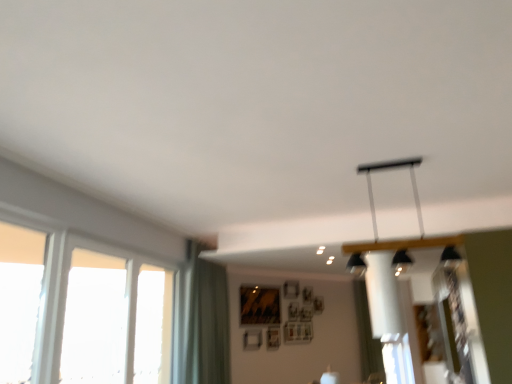
Where is `green fabric curtain at lower left, the second curtain from the back`? This screenshot has width=512, height=384. green fabric curtain at lower left, the second curtain from the back is located at coordinates (200, 321).

What do you see at coordinates (80, 309) in the screenshot?
I see `clear glass window at left, the 3th window viewed from the left` at bounding box center [80, 309].

You are a GUI agent. You are given a task and a screenshot of the screen. Output one action in this format:
    pyautogui.click(x=<x>, y=<y>)
    Task: Click on the white plastic window at left, which is the 1th window from left to right
    Image resolution: width=512 pixels, height=384 pixels.
    Given the screenshot: What is the action you would take?
    pyautogui.click(x=19, y=299)

Considering the sizes of objects transparent glass window at left, which is counted as the second window, starting from the right, and green fabric curtain at lower left, the first curtain viewed from the front, in the image provided, who is thinner, transparent glass window at left, which is counted as the second window, starting from the right, or green fabric curtain at lower left, the first curtain viewed from the front,?

Thinner between the two is transparent glass window at left, which is counted as the second window, starting from the right.

Is transparent glass window at left, which is counted as the 2th window, starting from the left, smaller than green fabric curtain at lower left, the 1th curtain in the left-to-right sequence?

Indeed, transparent glass window at left, which is counted as the 2th window, starting from the left, has a smaller size compared to green fabric curtain at lower left, the 1th curtain in the left-to-right sequence.

Based on the photo, from a real-world perspective, which is physically below, transparent glass window at left, which is counted as the second window, starting from the right, or green fabric curtain at lower left, the second curtain from the back?

transparent glass window at left, which is counted as the second window, starting from the right, from a real-world perspective.

Consider the image. Is transparent glass window at left, which is counted as the 2th window, starting from the left, positioned beyond the bounds of green fabric curtain at lower left, arranged as the 2th curtain when viewed from the right?

Yes.

From the image's perspective, is white plastic window at left, the third window from the right, located beneath clear glass window at left, placed as the first window when sorted from right to left?

No.

Is white plastic window at left, which is the 1th window from left to right, turned away from clear glass window at left, placed as the first window when sorted from right to left?

white plastic window at left, which is the 1th window from left to right, does not have its back to clear glass window at left, placed as the first window when sorted from right to left.

Based on the photo, is white plastic window at left, the third window from the right, to the left or to the right of clear glass window at left, placed as the first window when sorted from right to left, in the image?

From the image, it's evident that white plastic window at left, the third window from the right, is to the left of clear glass window at left, placed as the first window when sorted from right to left.

Could clear glass window at left, placed as the first window when sorted from right to left, be considered to be inside white plastic window at left, which is the 1th window from left to right?

That's incorrect, clear glass window at left, placed as the first window when sorted from right to left, is not inside white plastic window at left, which is the 1th window from left to right.

From a real-world perspective, does green fabric curtain at lower left, arranged as the 2th curtain when viewed from the right, stand above clear glass window at left, the 3th window viewed from the left?

Yes, from a real-world perspective, green fabric curtain at lower left, arranged as the 2th curtain when viewed from the right, is over clear glass window at left, the 3th window viewed from the left

Where is `curtain above the clear glass window at left, placed as the first window when sorted from right to left (from a real-world perspective)`? The image size is (512, 384). curtain above the clear glass window at left, placed as the first window when sorted from right to left (from a real-world perspective) is located at coordinates (200, 321).

Does green fabric curtain at lower left, the first curtain viewed from the front, have a greater height compared to clear glass window at left, the 3th window viewed from the left?

Yes.

Between green fabric curtain at lower left, arranged as the 2th curtain when viewed from the right, and clear glass window at left, the 3th window viewed from the left, which one has smaller size?

Smaller between the two is clear glass window at left, the 3th window viewed from the left.

Where is `window that appears on the left of transparent glass window at left, which is counted as the 2th window, starting from the left`? window that appears on the left of transparent glass window at left, which is counted as the 2th window, starting from the left is located at coordinates (19, 299).

How distant is transparent glass window at left, which is counted as the 2th window, starting from the left, from white plastic window at left, the third window from the right?

transparent glass window at left, which is counted as the 2th window, starting from the left, is 17.89 inches away from white plastic window at left, the third window from the right.

What's the angular difference between transparent glass window at left, which is counted as the 2th window, starting from the left, and white plastic window at left, the third window from the right,'s facing directions?

There is a 0.3-degree angle between the facing directions of transparent glass window at left, which is counted as the 2th window, starting from the left, and white plastic window at left, the third window from the right.

Looking at this image, considering the relative sizes of transparent glass window at left, which is counted as the second window, starting from the right, and white plastic window at left, which is the 1th window from left to right, in the image provided, is transparent glass window at left, which is counted as the second window, starting from the right, wider than white plastic window at left, which is the 1th window from left to right,?

Incorrect, the width of transparent glass window at left, which is counted as the second window, starting from the right, does not surpass that of white plastic window at left, which is the 1th window from left to right.

Which object is further away from the camera taking this photo, transparent glass window at left, which is counted as the 2th window, starting from the left, or clear glass window at left, placed as the first window when sorted from right to left?

transparent glass window at left, which is counted as the 2th window, starting from the left, is further from the camera.

Would you say transparent glass window at left, which is counted as the 2th window, starting from the left, is inside or outside clear glass window at left, the 3th window viewed from the left?

The correct answer is: inside.

Which point is more distant from viewer, [92,265] or [11,314]?

The point [92,265] is more distant.

Consider the image. Who is taller, transparent glass window at left, which is counted as the 2th window, starting from the left, or clear glass window at left, the 3th window viewed from the left?

Standing taller between the two is clear glass window at left, the 3th window viewed from the left.

Consider the image. Considering the relative sizes of white fabric curtain at center, the 1th curtain from the right, and clear glass window at left, the 3th window viewed from the left, in the image provided, is white fabric curtain at center, the 1th curtain from the right, shorter than clear glass window at left, the 3th window viewed from the left,?

Incorrect, the height of white fabric curtain at center, the 1th curtain from the right, does not fall short of that of clear glass window at left, the 3th window viewed from the left.

Between white fabric curtain at center, the 1th curtain from the right, and clear glass window at left, the 3th window viewed from the left, which one has larger width?

Wider between the two is white fabric curtain at center, the 1th curtain from the right.

From the image's perspective, is white fabric curtain at center, the 2th curtain from the front, on clear glass window at left, the 3th window viewed from the left?

No.

Is white fabric curtain at center, the 1th curtain from the back, positioned in front of clear glass window at left, placed as the first window when sorted from right to left?

No, it is not.

Who is bigger, clear glass window at left, the 3th window viewed from the left, or transparent glass window at left, which is counted as the 2th window, starting from the left?

clear glass window at left, the 3th window viewed from the left.

From the picture: Does clear glass window at left, placed as the first window when sorted from right to left, turn towards transparent glass window at left, which is counted as the 2th window, starting from the left?

Yes, clear glass window at left, placed as the first window when sorted from right to left, is aimed at transparent glass window at left, which is counted as the 2th window, starting from the left.

From the image's perspective, who appears lower, clear glass window at left, the 3th window viewed from the left, or transparent glass window at left, which is counted as the second window, starting from the right?

From the image's view, clear glass window at left, the 3th window viewed from the left, is below.

Who is more distant, clear glass window at left, placed as the first window when sorted from right to left, or transparent glass window at left, which is counted as the second window, starting from the right?

transparent glass window at left, which is counted as the second window, starting from the right, is further away from the camera.

From the image's perspective, count 2nd windows upward from the green fabric curtain at lower left, the second curtain from the back, and point to it. Please provide its 2D coordinates.

[(95, 319)]

Locate an element on the screen. This screenshot has width=512, height=384. the 1st window behind the white plastic window at left, the third window from the right, starting your count from the anchor is located at coordinates (80, 309).

Looking at the image, which one is located further to clear glass window at left, the 3th window viewed from the left, white fabric curtain at center, positioned as the second curtain in left-to-right order, or white plastic window at left, which is the 1th window from left to right?

Based on the image, white fabric curtain at center, positioned as the second curtain in left-to-right order, appears to be further to clear glass window at left, the 3th window viewed from the left.

When comparing their distances from white plastic window at left, the third window from the right, does green fabric curtain at lower left, arranged as the 2th curtain when viewed from the right, or white fabric curtain at center, the 2th curtain from the front, seem further?

Based on the image, white fabric curtain at center, the 2th curtain from the front, appears to be further to white plastic window at left, the third window from the right.

Which object lies further to the anchor point clear glass window at left, the 3th window viewed from the left, white plastic window at left, the third window from the right, or transparent glass window at left, which is counted as the second window, starting from the right?

Based on the image, white plastic window at left, the third window from the right, appears to be further to clear glass window at left, the 3th window viewed from the left.

From the image, which object appears to be farther from white plastic window at left, which is the 1th window from left to right, clear glass window at left, the 3th window viewed from the left, or green fabric curtain at lower left, the first curtain viewed from the front?

Among the two, green fabric curtain at lower left, the first curtain viewed from the front, is located further to white plastic window at left, which is the 1th window from left to right.

Looking at the image, which one is located further to green fabric curtain at lower left, the second curtain from the back, clear glass window at left, placed as the first window when sorted from right to left, or white plastic window at left, the third window from the right?

white plastic window at left, the third window from the right, is positioned further to the anchor green fabric curtain at lower left, the second curtain from the back.

Which object lies nearer to the anchor point clear glass window at left, placed as the first window when sorted from right to left, green fabric curtain at lower left, the first curtain viewed from the front, or white fabric curtain at center, the 1th curtain from the right?

green fabric curtain at lower left, the first curtain viewed from the front, is positioned closer to the anchor clear glass window at left, placed as the first window when sorted from right to left.

Based on their spatial positions, is clear glass window at left, placed as the first window when sorted from right to left, or transparent glass window at left, which is counted as the second window, starting from the right, further from white fabric curtain at center, the 1th curtain from the back?

transparent glass window at left, which is counted as the second window, starting from the right, lies further to white fabric curtain at center, the 1th curtain from the back, than the other object.

Looking at the image, which one is located further to white plastic window at left, which is the 1th window from left to right, transparent glass window at left, which is counted as the second window, starting from the right, or white fabric curtain at center, the 1th curtain from the right?

Based on the image, white fabric curtain at center, the 1th curtain from the right, appears to be further to white plastic window at left, which is the 1th window from left to right.

The image size is (512, 384). Identify the location of window between clear glass window at left, placed as the first window when sorted from right to left, and green fabric curtain at lower left, the first curtain viewed from the front, in the front-back direction. (95, 319).

Where is `window between white plastic window at left, which is the 1th window from left to right, and transparent glass window at left, which is counted as the second window, starting from the right, from front to back`? window between white plastic window at left, which is the 1th window from left to right, and transparent glass window at left, which is counted as the second window, starting from the right, from front to back is located at coordinates (80, 309).

Where is `curtain positioned between white plastic window at left, the third window from the right, and white fabric curtain at center, the 1th curtain from the right, from near to far`? This screenshot has height=384, width=512. curtain positioned between white plastic window at left, the third window from the right, and white fabric curtain at center, the 1th curtain from the right, from near to far is located at coordinates (200, 321).

The height and width of the screenshot is (384, 512). I want to click on curtain located between clear glass window at left, the 3th window viewed from the left, and white fabric curtain at center, positioned as the second curtain in left-to-right order, in the depth direction, so click(200, 321).